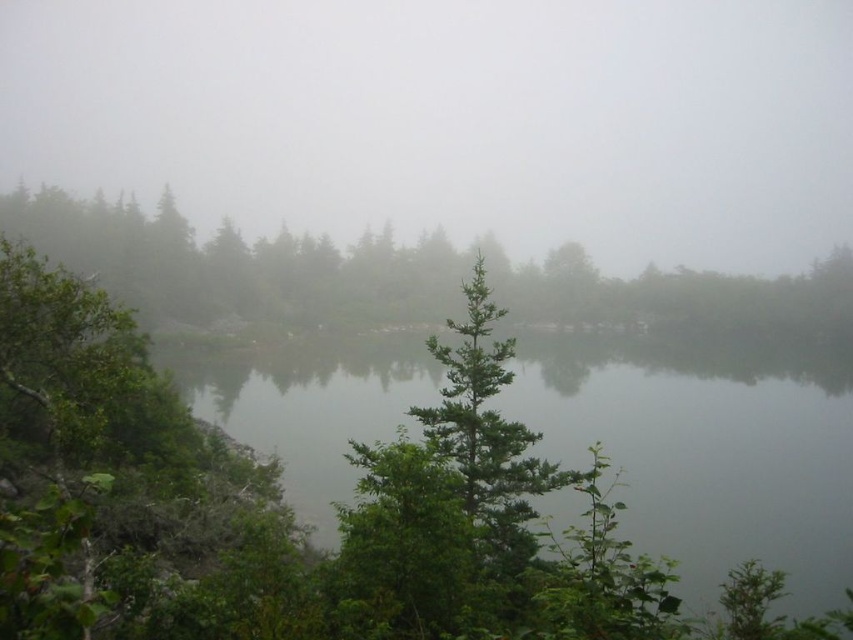
Who is positioned more to the right, green leafy water at center or green matte tree at upper left?

From the viewer's perspective, green leafy water at center appears more on the right side.

This screenshot has height=640, width=853. Describe the element at coordinates (708, 449) in the screenshot. I see `green leafy water at center` at that location.

I want to click on green leafy water at center, so click(x=708, y=449).

Consider the image. Does foggy atmosphere at upper center appear on the right side of green leafy water at center?

No, foggy atmosphere at upper center is not to the right of green leafy water at center.

Is foggy atmosphere at upper center closer to camera compared to green leafy water at center?

No, foggy atmosphere at upper center is further to the viewer.

Is point (701, 246) positioned before point (848, 538)?

No, (701, 246) is further to viewer.

Locate an element on the screen. The image size is (853, 640). foggy atmosphere at upper center is located at coordinates (451, 118).

Can you confirm if foggy atmosphere at upper center is bigger than green matte tree at upper left?

Yes, foggy atmosphere at upper center is bigger than green matte tree at upper left.

Is foggy atmosphere at upper center behind green matte tree at upper left?

That is True.

Based on the photo, who is more forward, (540, 161) or (566, 323)?

Positioned in front is point (566, 323).

I want to click on foggy atmosphere at upper center, so pyautogui.click(x=451, y=118).